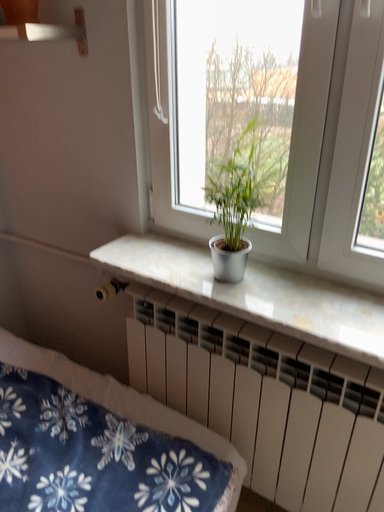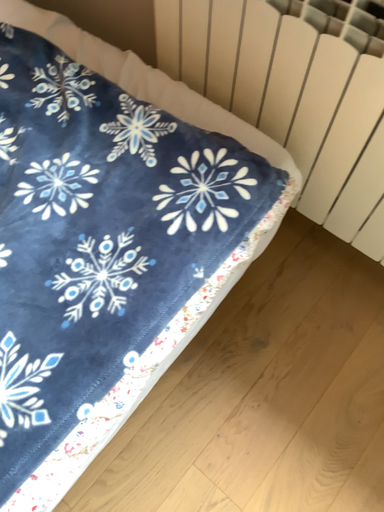
Question: How did the camera likely rotate when shooting the video?

Choices:
 (A) rotated upward
 (B) rotated downward

Answer: (B)